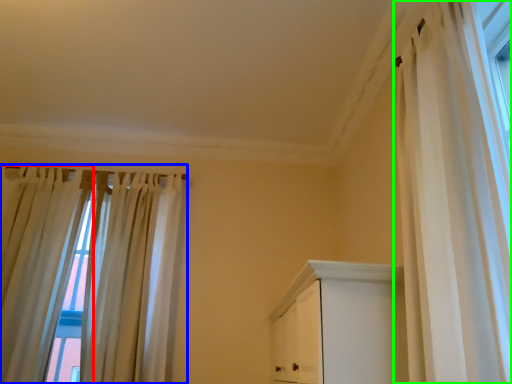
Question: Considering the real-world distances, which object is farthest from curtain (highlighted by a red box)? curtain (highlighted by a blue box) or curtain (highlighted by a green box)?

Choices:
 (A) curtain
 (B) curtain

Answer: (B)